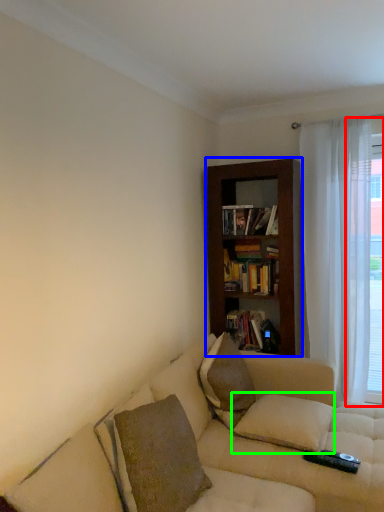
Question: Considering the real-world distances, which object is farthest from window frame (highlighted by a red box)? bookcase (highlighted by a blue box) or pillow (highlighted by a green box)?

Choices:
 (A) bookcase
 (B) pillow

Answer: (B)